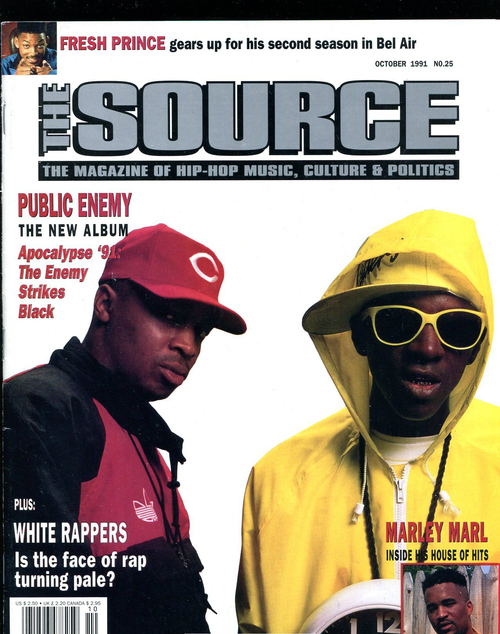
Where is `clock`? This screenshot has width=500, height=634. clock is located at coordinates (359, 624).